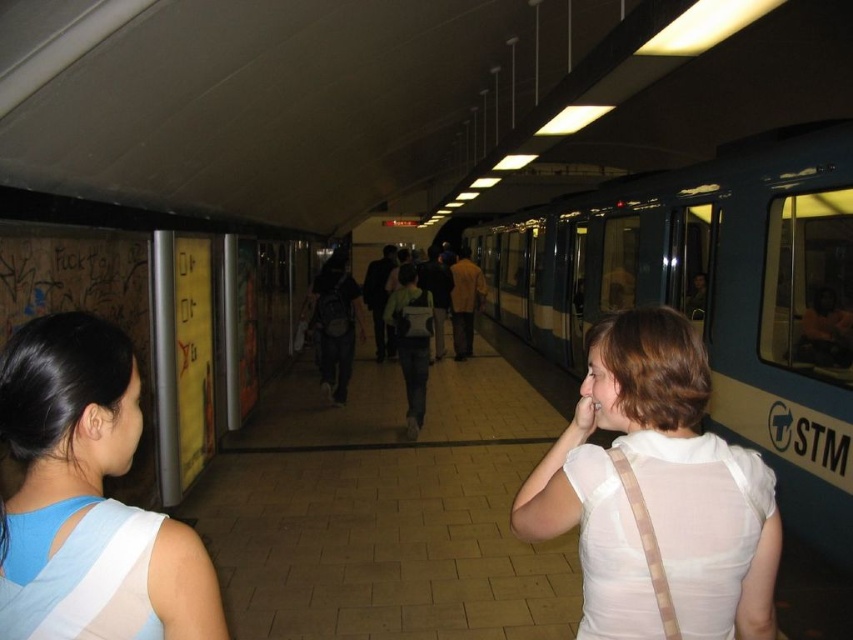
Question: Estimate the real-world distances between objects in this image. Which object is farther from the blue metallic train at center?

Choices:
 (A) blue fabric shirt at left
 (B) white sheer blouse at center

Answer: (A)

Question: Can you confirm if blue metallic train at center is smaller than blue fabric shirt at left?

Choices:
 (A) no
 (B) yes

Answer: (A)

Question: Is blue metallic train at center closer to the viewer compared to blue fabric shirt at left?

Choices:
 (A) yes
 (B) no

Answer: (B)

Question: Which point appears farthest from the camera in this image?

Choices:
 (A) (57, 344)
 (B) (546, 477)

Answer: (B)

Question: Which point is farther to the camera?

Choices:
 (A) blue metallic train at center
 (B) blue fabric shirt at left

Answer: (A)

Question: Can you confirm if blue metallic train at center is positioned to the left of white sheer blouse at center?

Choices:
 (A) no
 (B) yes

Answer: (A)